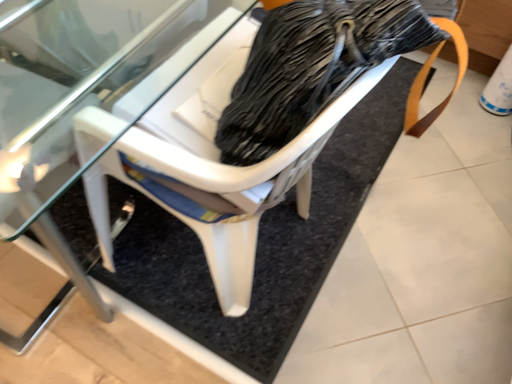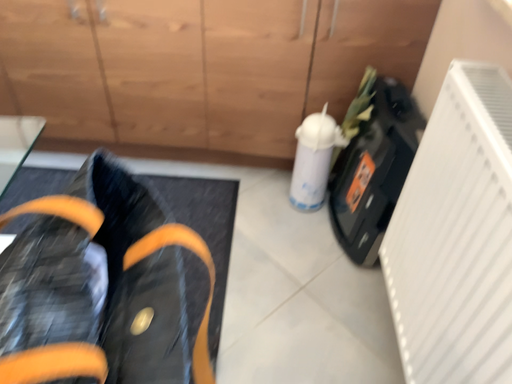
Question: How did the camera likely rotate when shooting the video?

Choices:
 (A) rotated left
 (B) rotated right

Answer: (B)